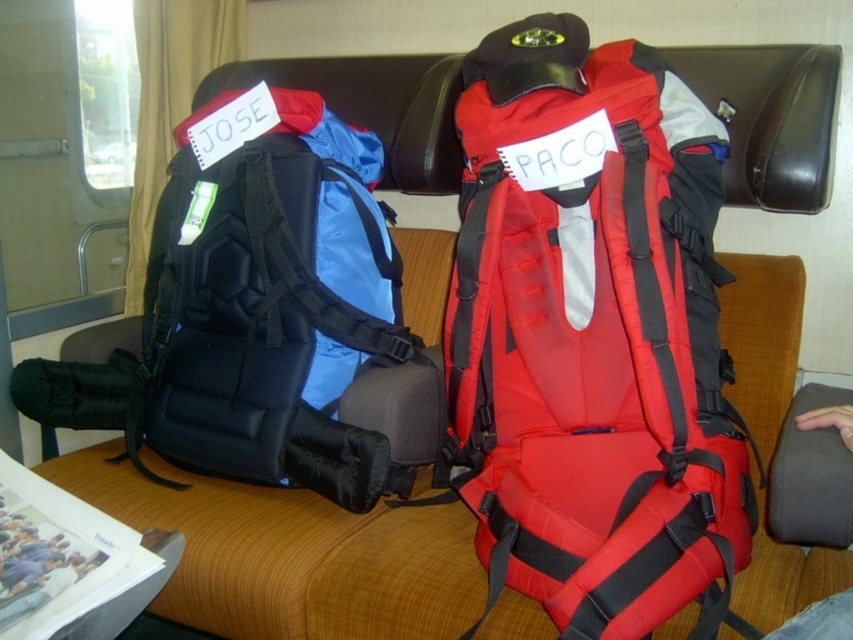
Between point (666, 476) and point (198, 417), which one is positioned behind?

Positioned behind is point (198, 417).

Between matte red backpack at center and matte black backpack at left, which one appears on the right side from the viewer's perspective?

matte red backpack at center

Locate an element on the screen. matte red backpack at center is located at coordinates (592, 337).